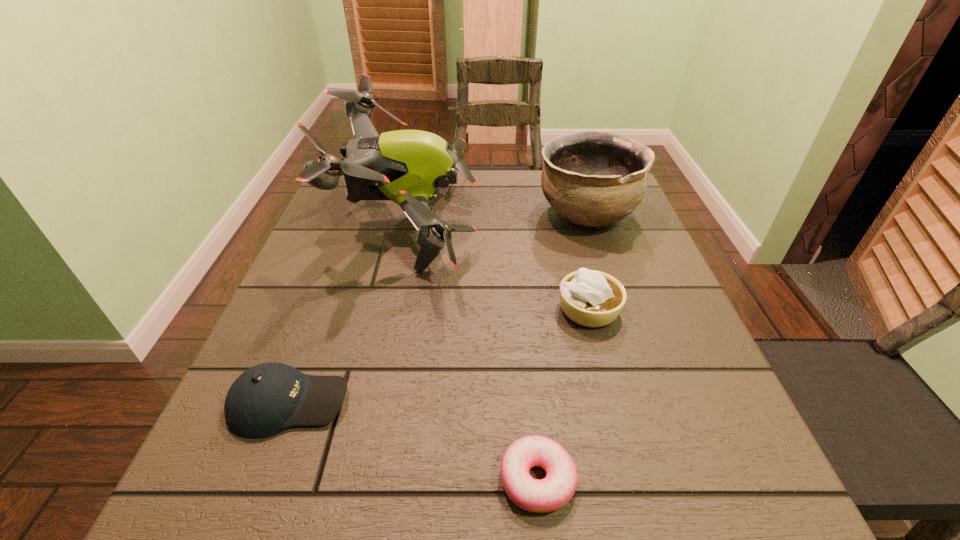
The image size is (960, 540). In order to click on unoccupied area between the fourth farthest object and the pottery in this screenshot , I will do `click(438, 308)`.

Where is `empty location between the whipped cream and the fourth tallest object`? The image size is (960, 540). empty location between the whipped cream and the fourth tallest object is located at coordinates (439, 356).

This screenshot has height=540, width=960. Find the location of `free point between the nearest object and the tallest object`. free point between the nearest object and the tallest object is located at coordinates (473, 352).

Locate an element on the screen. free spot between the pottery and the drone is located at coordinates (497, 220).

Find the location of a particular element. This screenshot has width=960, height=540. free space between the third tallest object and the doughnut is located at coordinates (564, 394).

The height and width of the screenshot is (540, 960). Find the location of `free space between the whipped cream and the drone`. free space between the whipped cream and the drone is located at coordinates (499, 267).

Where is `free space between the nearest object and the baseball cap`? The image size is (960, 540). free space between the nearest object and the baseball cap is located at coordinates (414, 441).

Choose which object is the fourth nearest neighbor to the fourth shortest object. Please provide its 2D coordinates. Your answer should be formatted as a tuple, i.e. [(x, y)], where the tuple contains the x and y coordinates of a point satisfying the conditions above.

[(264, 400)]

Locate an element on the screen. object that is the fourth nearest to the third shortest object is located at coordinates (264, 400).

Locate an element on the screen. This screenshot has width=960, height=540. vacant space that satisfies the following two spatial constraints: 1. on the front-facing side of the third tallest object; 2. on the left side of the drone is located at coordinates (391, 309).